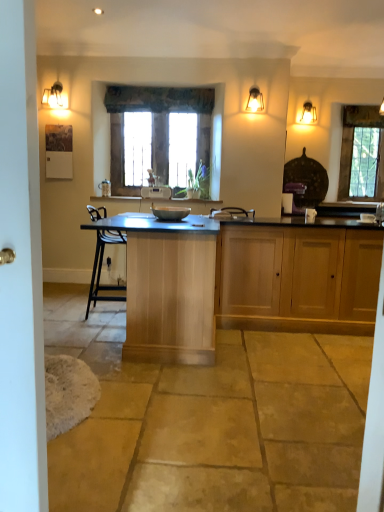
Question: Can you confirm if light wood cabinet at center, acting as the second cabinetry starting from the right, is smaller than wooden frame at center, marked as the 2th window in a back-to-front arrangement?

Choices:
 (A) yes
 (B) no

Answer: (B)

Question: Is light wood cabinet at center, the 1th cabinetry when ordered from left to right, at the right side of wooden frame at center, which appears as the 2th window when viewed from the right?

Choices:
 (A) yes
 (B) no

Answer: (A)

Question: Is light wood cabinet at center, acting as the second cabinetry starting from the right, at the left side of wooden frame at center, the first window viewed from the front?

Choices:
 (A) no
 (B) yes

Answer: (A)

Question: Is wooden frame at center, marked as the 2th window in a back-to-front arrangement, located within light wood cabinet at center, the 1th cabinetry when ordered from left to right?

Choices:
 (A) yes
 (B) no

Answer: (B)

Question: Can we say light wood cabinet at center, acting as the second cabinetry starting from the right, lies outside wooden frame at center, the first window positioned from the left?

Choices:
 (A) no
 (B) yes

Answer: (B)

Question: In terms of height, does satin nickel faucet at right look taller or shorter compared to wooden cabinet at center, arranged as the 1th cabinetry when viewed from the right?

Choices:
 (A) short
 (B) tall

Answer: (A)

Question: Looking at the image, does satin nickel faucet at right seem bigger or smaller compared to wooden cabinet at center, arranged as the 1th cabinetry when viewed from the right?

Choices:
 (A) big
 (B) small

Answer: (B)

Question: From the image's perspective, is satin nickel faucet at right above or below wooden cabinet at center, arranged as the 1th cabinetry when viewed from the right?

Choices:
 (A) below
 (B) above

Answer: (B)

Question: Is point (377, 217) positioned closer to the camera than point (357, 301)?

Choices:
 (A) farther
 (B) closer

Answer: (A)

Question: Considering their positions, is wooden cabinet at center, the second cabinetry when ordered from left to right, located in front of or behind matte brass sconce at upper left, which is the 2th light fixture from back to front?

Choices:
 (A) front
 (B) behind

Answer: (A)

Question: Considering the relative positions of wooden cabinet at center, the second cabinetry when ordered from left to right, and matte brass sconce at upper left, acting as the first light fixture starting from the left, in the image provided, is wooden cabinet at center, the second cabinetry when ordered from left to right, to the left or to the right of matte brass sconce at upper left, acting as the first light fixture starting from the left,?

Choices:
 (A) right
 (B) left

Answer: (A)

Question: From the image's perspective, is wooden cabinet at center, the second cabinetry when ordered from left to right, above or below matte brass sconce at upper left, acting as the first light fixture starting from the left?

Choices:
 (A) below
 (B) above

Answer: (A)

Question: Based on their sizes in the image, would you say wooden cabinet at center, arranged as the 1th cabinetry when viewed from the right, is bigger or smaller than matte brass sconce at upper left, acting as the first light fixture starting from the left?

Choices:
 (A) small
 (B) big

Answer: (B)

Question: Visually, is wooden cabinet at center, arranged as the 1th cabinetry when viewed from the right, positioned to the left or to the right of satin nickel faucet at right?

Choices:
 (A) left
 (B) right

Answer: (A)

Question: Looking at the image, does wooden cabinet at center, the second cabinetry when ordered from left to right, seem bigger or smaller compared to satin nickel faucet at right?

Choices:
 (A) small
 (B) big

Answer: (B)